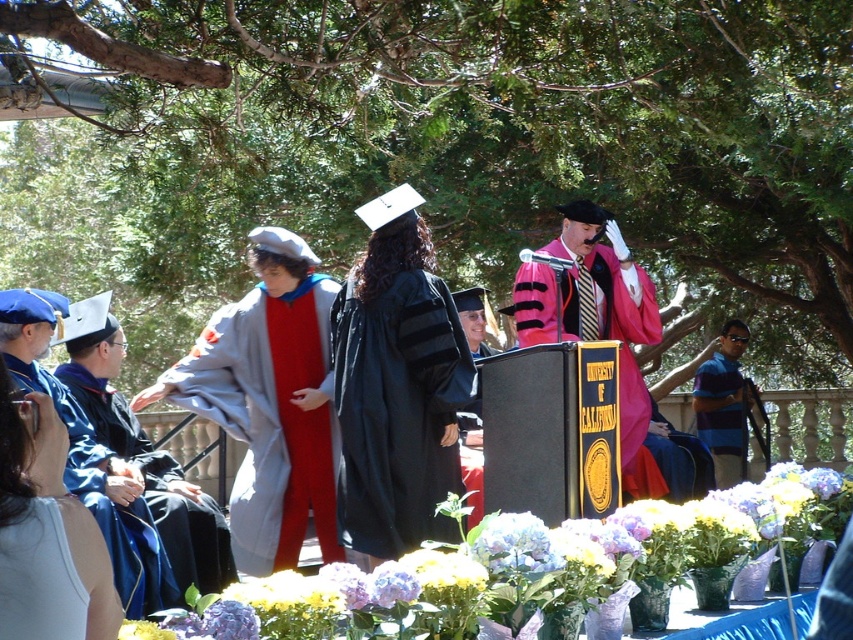
What object is located at the coordinates point (144, 451)?

The point (144, 451) corresponds to the blue velvet gown at left.

You are a photographer positioned at the back of the ceremony venue. You want to take a photo that includes both the gray wool gown at center and the blue satin gown at lower left. Which gown should you adjust your camera focus to first to ensure both are in the frame?

The gray wool gown at center is closer to you than the blue satin gown at lower left, so you should focus on the gray wool gown at center first to ensure both are in the frame.

You are a photographer at the graduation ceremony. You need to capture a photo that includes both the blue velvet gown at left and the matte pink fabric graduation gown at center. Which gown should you ensure is positioned closer to the camera to avoid being blocked by the other?

The blue velvet gown at left is not as tall as the matte pink fabric graduation gown at center. To avoid blocking, position the shorter blue velvet gown at left closer to the camera so it can be seen clearly alongside the taller matte pink fabric graduation gown at center.